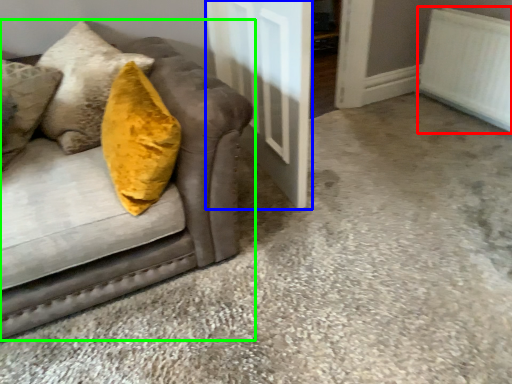
Question: Which object is positioned closest to radiator (highlighted by a red box)? Select from door (highlighted by a blue box) and studio couch (highlighted by a green box).

Choices:
 (A) door
 (B) studio couch

Answer: (A)